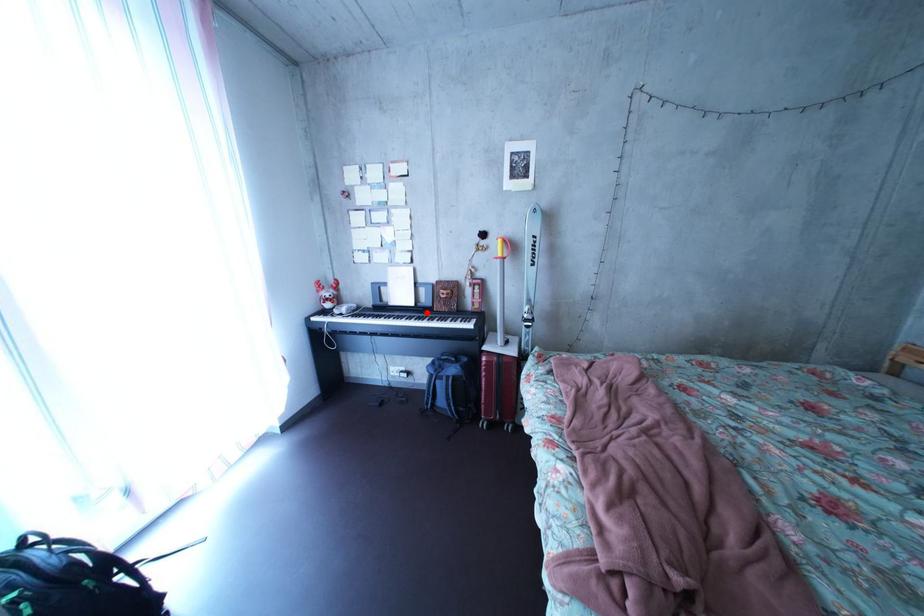
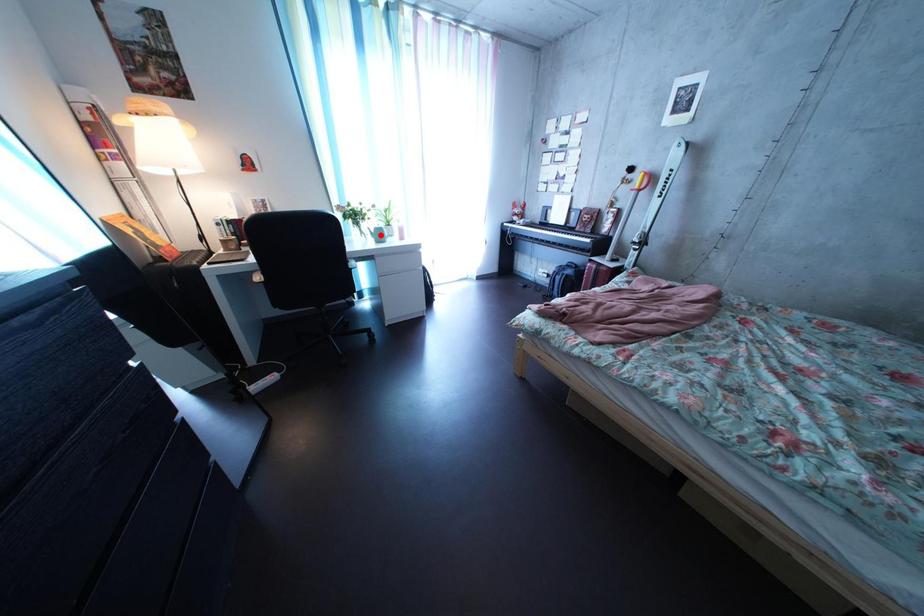
I am providing you with two images of the same scene from different viewpoints. A red point is marked on the first image and another point is marked on the second image. Do the highlighted points in image1 and image2 indicate the same real-world spot?

No